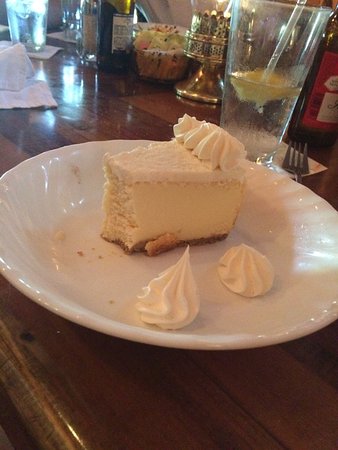
At what (x,y) coordinates should I click in order to perform the action: click on bottle. Please return your answer as a coordinate pair (x, y). This screenshot has width=338, height=450. Looking at the image, I should click on (115, 24).